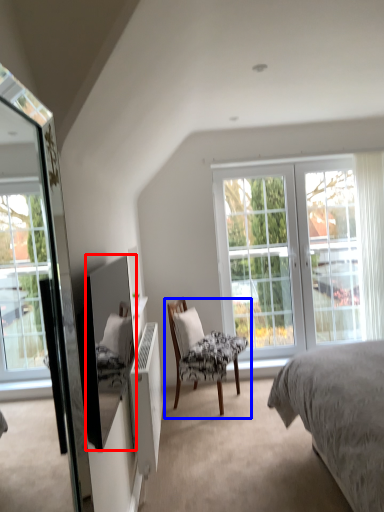
Question: Among these objects, which one is nearest to the camera, mirror (highlighted by a red box) or chair (highlighted by a blue box)?

Choices:
 (A) mirror
 (B) chair

Answer: (A)